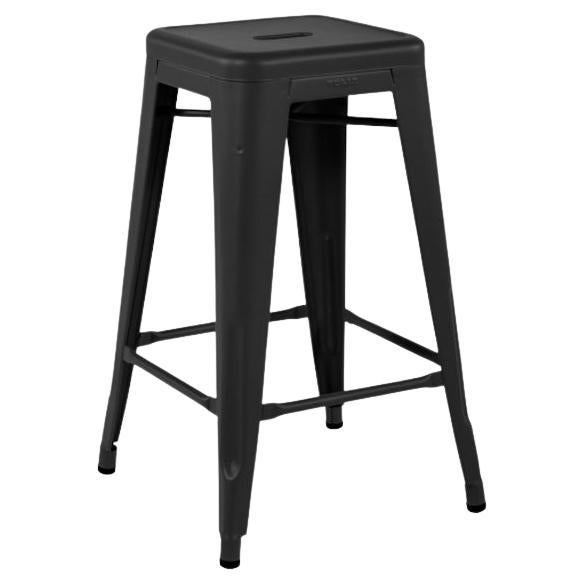
Locate an element on the screen. indented area around stool seat is located at coordinates (162, 37), (213, 52), (309, 53), (371, 46).